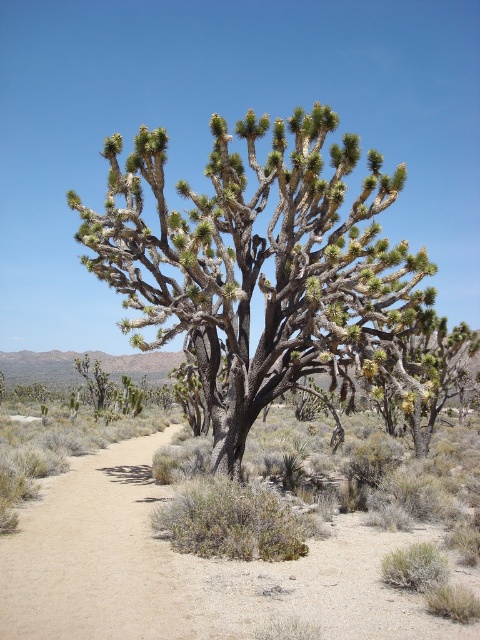
Can you confirm if brown sandy dirt track at center is taller than brown sandy trail at lower left?

Incorrect, brown sandy dirt track at center's height is not larger of brown sandy trail at lower left's.

Which is behind, point (192, 611) or point (36, 548)?

The point (36, 548) is more distant.

Measure the distance between brown sandy dirt track at center and camera.

brown sandy dirt track at center and camera are 4.69 meters apart from each other.

Locate an element on the screen. The width and height of the screenshot is (480, 640). brown sandy dirt track at center is located at coordinates (187, 568).

Which of these two, green spiny joshua tree at center or brown sandy dirt track at center, stands shorter?

brown sandy dirt track at center is shorter.

Between point (325, 349) and point (62, 504), which one is positioned behind?

The point (62, 504) is behind.

Who is more forward, (338,205) or (181,556)?

Point (181,556)

Identify the location of green spiny joshua tree at center. (256, 262).

Is green spiny joshua tree at center shorter than brown sandy trail at lower left?

In fact, green spiny joshua tree at center may be taller than brown sandy trail at lower left.

Does green spiny joshua tree at center appear on the right side of brown sandy trail at lower left?

Indeed, green spiny joshua tree at center is positioned on the right side of brown sandy trail at lower left.

The width and height of the screenshot is (480, 640). I want to click on green spiny joshua tree at center, so click(x=256, y=262).